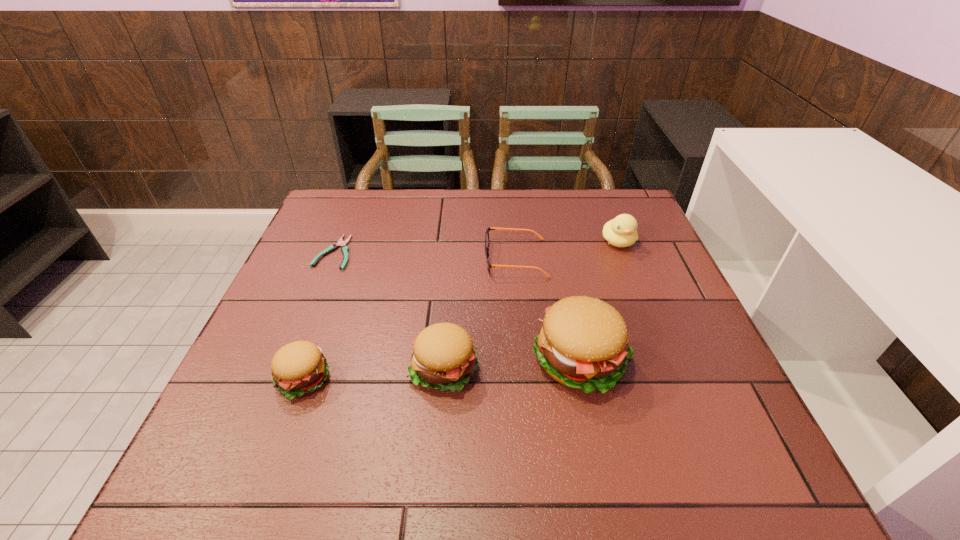
You are a GUI agent. You are given a task and a screenshot of the screen. Output one action in this format:
    pyautogui.click(x=<x>, y=<y>)
    Task: Click on the free space located 0.120m on the back of the third object from left to right
    
    Given the screenshot: What is the action you would take?
    pyautogui.click(x=449, y=304)

In order to click on vacant region located 0.350m on the back of the tallest object in this screenshot , I will do `click(554, 234)`.

At what (x,y) coordinates should I click in order to perform the action: click on vacant space located at the beak of the rightmost object. Please return your answer as a coordinate pair (x, y). Looking at the image, I should click on (653, 328).

In order to click on free location located on the front-facing side of the spectacles in this screenshot , I will do `click(450, 258)`.

Find the location of a particular element. free space located 0.080m on the front-facing side of the spectacles is located at coordinates 454,258.

The image size is (960, 540). Identify the location of free spot located on the front-facing side of the spectacles. [369, 258].

In order to click on vacant space located on the back of the shortest object in this screenshot , I will do `click(356, 199)`.

At what (x,y) coordinates should I click in order to perform the action: click on object that is positioned at the far edge. Please return your answer as a coordinate pair (x, y). This screenshot has height=540, width=960. Looking at the image, I should click on (621, 231).

You are a GUI agent. You are given a task and a screenshot of the screen. Output one action in this format:
    pyautogui.click(x=<x>, y=<y>)
    Task: Click on the hamburger present at the left edge
    
    Given the screenshot: What is the action you would take?
    pyautogui.click(x=298, y=368)

Find the location of a particular element. pliers located at the left edge is located at coordinates (344, 248).